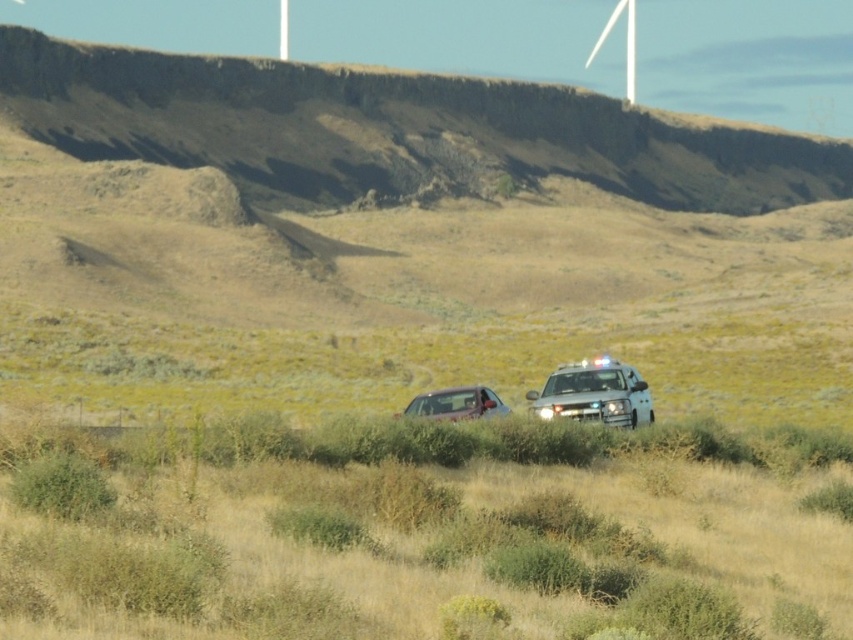
You are standing at the camera position and want to place a marker at the closest point between point [498,524] and point [633,380]. Which point should you choose?

Point [498,524] is closer to the camera than point [633,380], so you should choose point [498,524] as the closest point.

You are a pedestrian standing on the side of the road in the scene. You see the white glossy police car at lower right and the metallic silver car at center. Which vehicle is closer to the right edge of the road?

The white glossy police car at lower right is closer to the right edge of the road because it is positioned to the right of the metallic silver car at center.